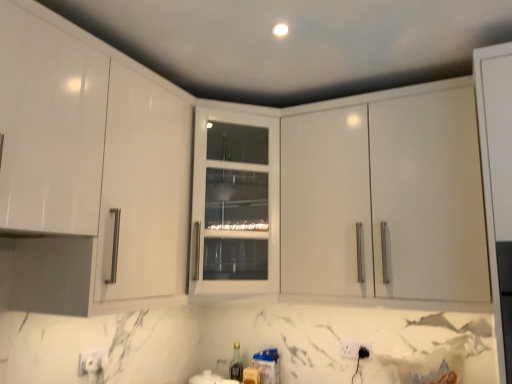
Question: Looking at the image, does white plastic electric outlet at lower center, which is the 1th electric outlet from back to front, seem bigger or smaller compared to glossy white cabinet at upper right, which ranks as the second cabinetry in left-to-right order?

Choices:
 (A) big
 (B) small

Answer: (B)

Question: From their relative heights in the image, would you say white plastic electric outlet at lower center, which is the 1th electric outlet from back to front, is taller or shorter than glossy white cabinet at upper right, which ranks as the second cabinetry in left-to-right order?

Choices:
 (A) tall
 (B) short

Answer: (B)

Question: Which object is the farthest from the white glass cabinet at center, the 2th cabinetry in the right-to-left sequence?

Choices:
 (A) white plastic electric outlet at lower center, arranged as the first electric outlet when viewed from the front
 (B) glossy white cabinet at upper right, marked as the first cabinetry in a right-to-left arrangement
 (C) white plastic electric outlet at lower center, which is the 1th electric outlet from back to front

Answer: (A)

Question: Considering the real-world distances, which object is closest to the white plastic electric outlet at lower center, which is the second electric outlet from front to back?

Choices:
 (A) white glass cabinet at center, arranged as the first cabinetry when viewed from the left
 (B) glossy white cabinet at upper right, which ranks as the second cabinetry in left-to-right order
 (C) white plastic electric outlet at lower center, acting as the 2th electric outlet starting from the back

Answer: (C)